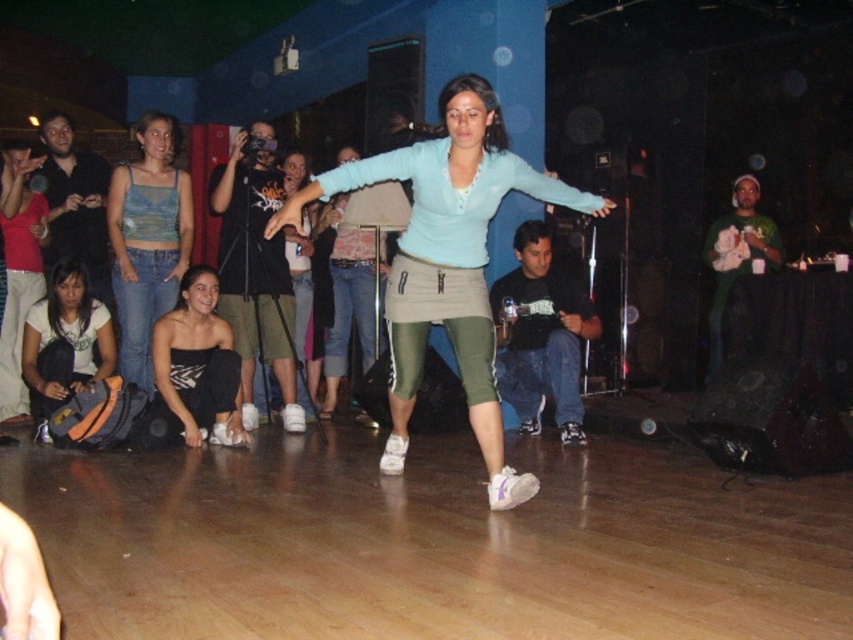
You are standing at the point marked as point (x=39, y=390) in the image. A dance instructor wants to give a hand signal to the group of people in the scene. Can you estimate if the instructor can clearly see the group from your current position?

The point (x=39, y=390) is 5.35 meters away from the viewer. Since the instructor is at this point, they can clearly see the group of people in the scene as there are no obstructions mentioned in the scene description.

You are a photographer at the dance class and want to capture both the matte blue sweater at center and the matte black tank top at center in a single frame. Which clothing item should you focus on first to ensure both are in the frame?

The matte blue sweater at center is not as tall as the matte black tank top at center, so you should focus on the taller matte black tank top at center first to ensure both are in the frame.

Based on the photo, you are a photographer standing at the camera position. You want to take a closeup photo of the matte blue sweater at center. Can you estimate how far you need to move forward to get a clear shot?

The matte blue sweater at center is 3.64 meters from the camera. To get a closeup, you would need to move forward approximately 3.64 meters to be closer to the sweater.